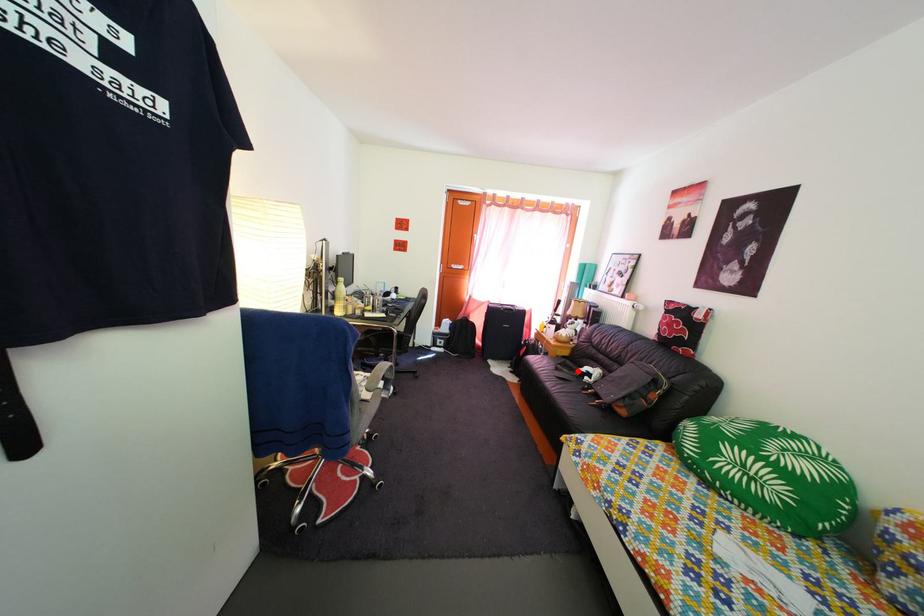
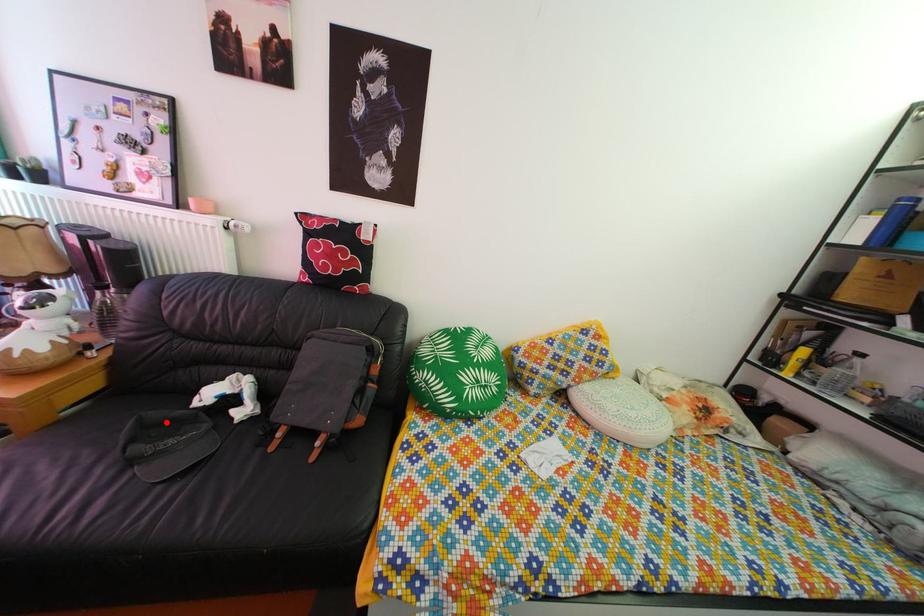
I am providing you with two images of the same scene from different viewpoints. A red point is marked on the first image and another point is marked on the second image. Do the highlighted points in image1 and image2 indicate the same real-world spot?

Yes